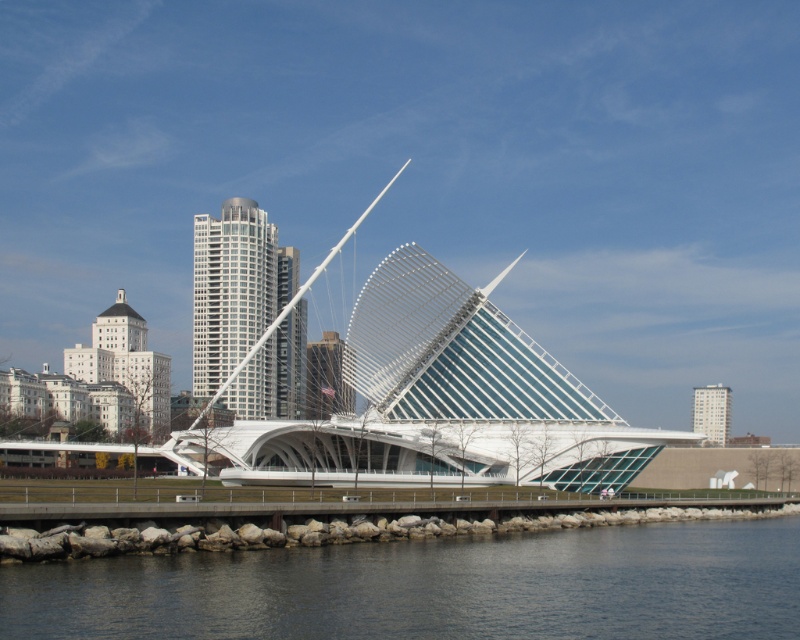
Is dark blue water at lower center behind white glass pedestrian bridge at center?

No, it is in front of white glass pedestrian bridge at center.

Is dark blue water at lower center below white glass pedestrian bridge at center?

Yes.

Which is behind, point (14, 608) or point (285, 429)?

The point (285, 429) is behind.

Identify the location of dark blue water at lower center. The height and width of the screenshot is (640, 800). (433, 588).